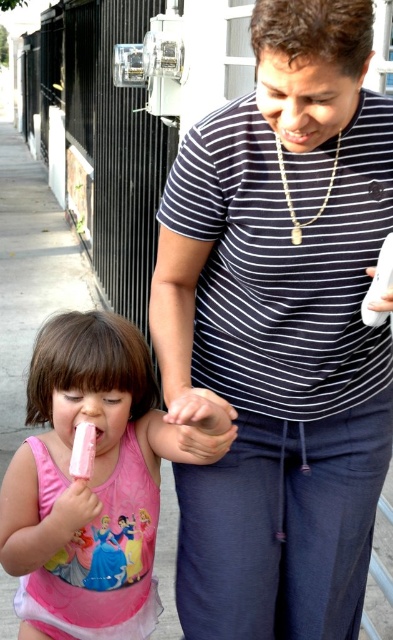
How much distance is there between striped cotton shirt at center and pink matte swimsuit at lower left?

striped cotton shirt at center and pink matte swimsuit at lower left are 11.96 inches apart from each other.

Between striped cotton shirt at center and pink matte swimsuit at lower left, which one is positioned lower?

pink matte swimsuit at lower left

The height and width of the screenshot is (640, 393). In order to click on striped cotton shirt at center in this screenshot , I will do `click(282, 332)`.